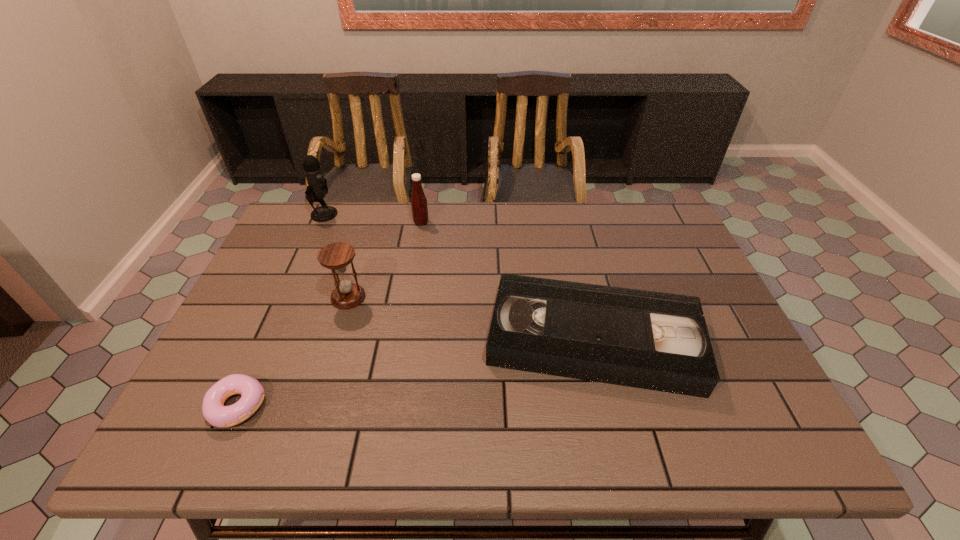
This screenshot has height=540, width=960. I want to click on the tallest object, so pos(317,188).

Find the location of `Tabasco sauce`. Tabasco sauce is located at coordinates (419, 206).

You are a GUI agent. You are given a task and a screenshot of the screen. Output one action in this format:
    pyautogui.click(x=<x>, y=<y>)
    Task: Click on the hourglass
    The width and height of the screenshot is (960, 540).
    Given the screenshot: What is the action you would take?
    pyautogui.click(x=336, y=256)

Locate an element on the screen. The width and height of the screenshot is (960, 540). videotape is located at coordinates (659, 341).

Find the location of a particular element. This screenshot has height=540, width=960. the second shortest object is located at coordinates (659, 341).

Identify the location of doughnut. This screenshot has height=540, width=960. (213, 409).

The image size is (960, 540). I want to click on vacant space situated on the front of the microphone, so click(294, 281).

Find the location of a particular element. blank space located 0.050m on the left of the fourth object from left to right is located at coordinates (398, 222).

Where is `vacant space located on the right of the hourglass`? The width and height of the screenshot is (960, 540). vacant space located on the right of the hourglass is located at coordinates (467, 297).

In order to click on free location located on the back of the videotape in this screenshot , I will do click(x=562, y=208).